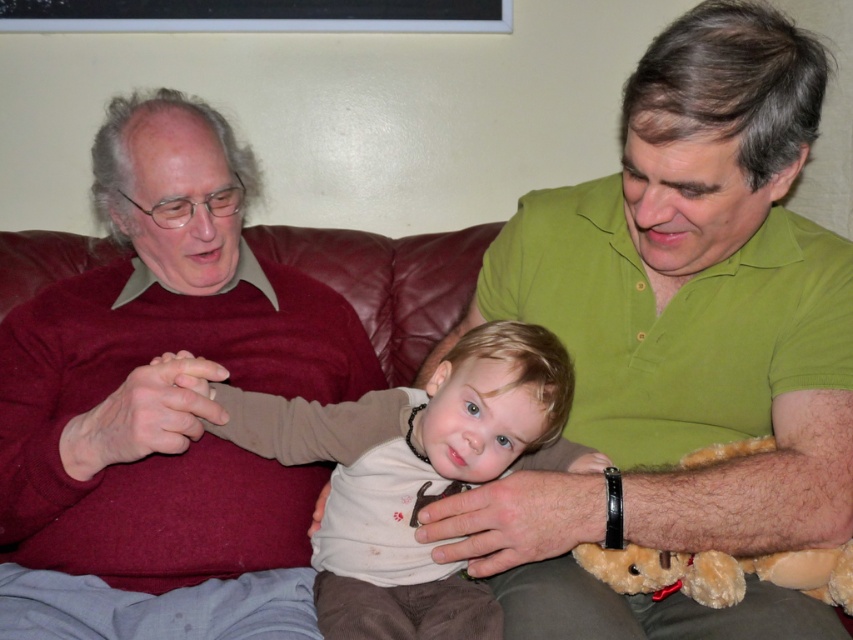
Question: Can you confirm if green matte shirt at center is smaller than light beige soft fabric shirt at center?

Choices:
 (A) no
 (B) yes

Answer: (A)

Question: Considering the real-world distances, which object is farthest from the green matte shirt at center?

Choices:
 (A) maroon sweater at left
 (B) light beige soft fabric shirt at center

Answer: (A)

Question: Is green matte shirt at center to the left of maroon sweater at left from the viewer's perspective?

Choices:
 (A) no
 (B) yes

Answer: (A)

Question: Among these points, which one is farthest from the camera?

Choices:
 (A) (294, 324)
 (B) (849, 483)

Answer: (A)

Question: Which of these objects is positioned farthest from the green matte shirt at center?

Choices:
 (A) maroon sweater at left
 (B) brown plush teddy bear at lower right

Answer: (A)

Question: Where is green matte shirt at center located in relation to light beige soft fabric shirt at center in the image?

Choices:
 (A) above
 (B) below

Answer: (A)